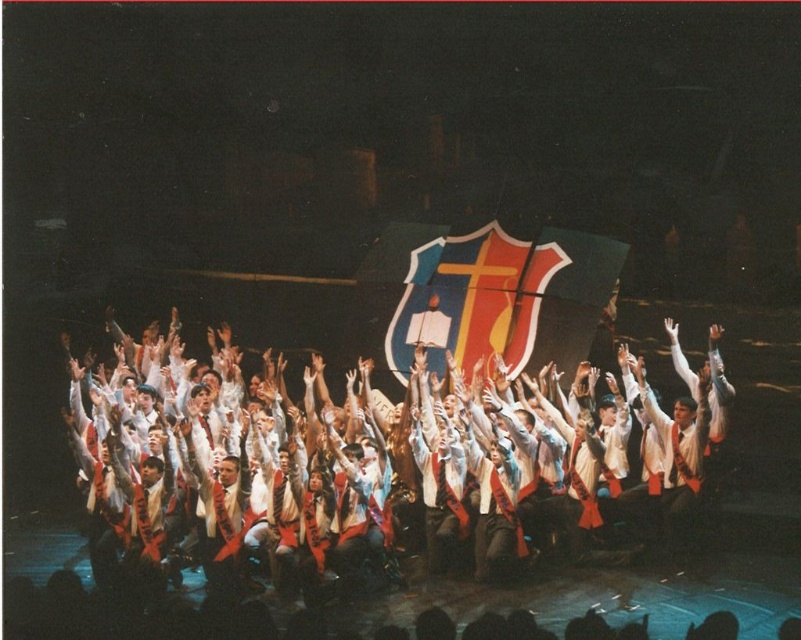
Based on the photo, does white fabric shirt at center have a smaller size compared to shiny plastic flag at center?

Incorrect, white fabric shirt at center is not smaller in size than shiny plastic flag at center.

Between point (455, 364) and point (409, 243), which one is positioned behind?

Point (409, 243)

Does point (488, 545) come behind point (425, 332)?

That is False.

Find the location of a particular element. Image resolution: width=801 pixels, height=640 pixels. white fabric shirt at center is located at coordinates (228, 476).